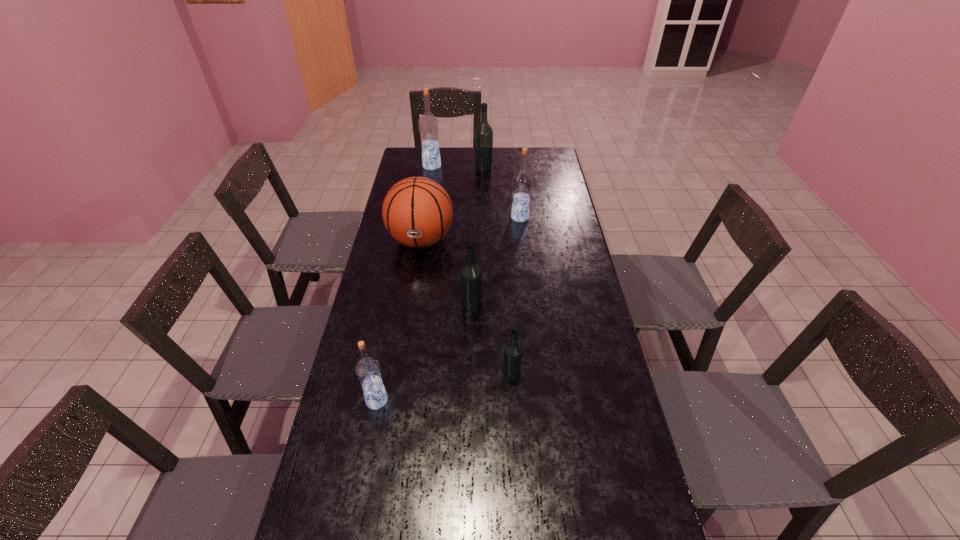
This screenshot has height=540, width=960. What are the coordinates of `object that is at the far left corner` in the screenshot? It's located at (428, 124).

This screenshot has height=540, width=960. I want to click on vacant point at the far edge, so click(x=457, y=169).

This screenshot has height=540, width=960. I want to click on vacant area at the left edge of the desktop, so click(x=390, y=253).

Where is `vacant region at the right edge`? The height and width of the screenshot is (540, 960). vacant region at the right edge is located at coordinates (576, 262).

Image resolution: width=960 pixels, height=540 pixels. What are the coordinates of `vacant region at the far left corner` in the screenshot? It's located at pos(411,168).

In the image, there is a desktop. At what (x,y) coordinates should I click in order to perform the action: click on vacant space at the far right corner. Please return your answer as a coordinate pair (x, y). Image resolution: width=960 pixels, height=540 pixels. Looking at the image, I should click on (537, 160).

This screenshot has width=960, height=540. Identify the location of free point between the nearest vodka and the biggest black vodka. (430, 284).

Where is `free space that is in between the nearest blue vodka and the biggest black vodka`? free space that is in between the nearest blue vodka and the biggest black vodka is located at coordinates (430, 284).

The image size is (960, 540). In order to click on free space between the farthest black vodka and the shortest vodka in this screenshot , I will do `click(497, 271)`.

The height and width of the screenshot is (540, 960). I want to click on vacant point located between the nearest object and the second smallest blue vodka, so click(x=448, y=309).